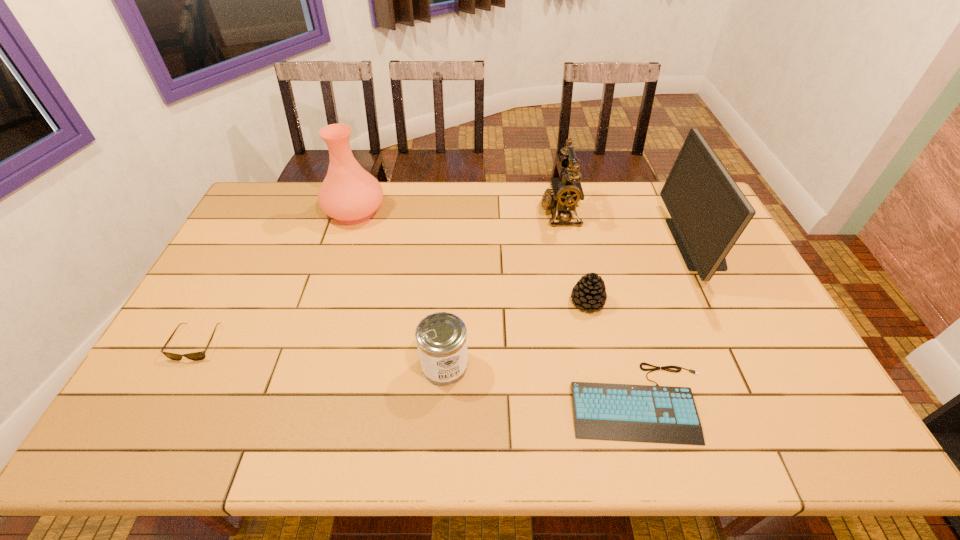
The width and height of the screenshot is (960, 540). I want to click on vase that is at the far edge, so click(x=349, y=194).

Where is `computer monitor positioned at the far edge`? computer monitor positioned at the far edge is located at coordinates (709, 212).

What are the coordinates of `telephone that is at the far edge` in the screenshot? It's located at (566, 193).

I want to click on object present at the near edge, so click(642, 413).

This screenshot has width=960, height=540. I want to click on object that is at the left edge, so click(x=196, y=356).

This screenshot has width=960, height=540. I want to click on object located in the right edge section of the desktop, so click(709, 212).

You are a GUI agent. You are given a task and a screenshot of the screen. Output one action in this format:
    pyautogui.click(x=<x>, y=<y>)
    Task: Click on the object that is at the far right corner
    The height and width of the screenshot is (540, 960).
    Given the screenshot: What is the action you would take?
    pyautogui.click(x=709, y=212)

In order to click on free space at the far edge of the desktop in this screenshot , I will do `click(623, 183)`.

At what (x,y) coordinates should I click in order to perform the action: click on free space at the left edge of the desktop. Please return your answer as a coordinate pair (x, y). The image size is (960, 540). Looking at the image, I should click on (181, 333).

In the image, there is a desktop. What are the coordinates of `vacant space at the right edge` in the screenshot? It's located at (746, 334).